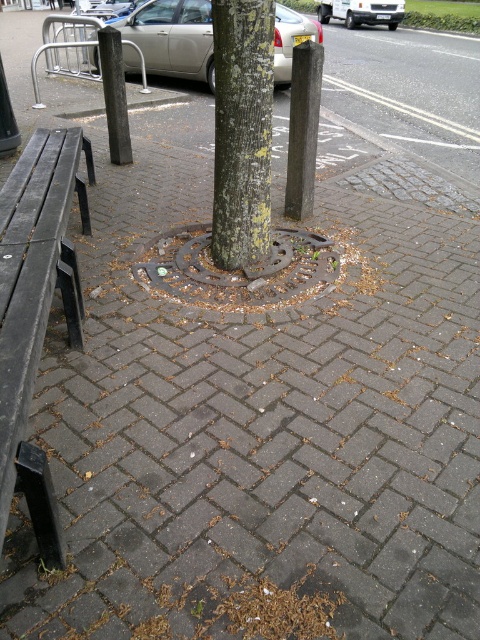
Question: Does dark gray stone post at center appear on the left side of dark gray textured pole at left?

Choices:
 (A) no
 (B) yes

Answer: (A)

Question: Which object appears farthest from the camera in this image?

Choices:
 (A) silver metallic car at upper center
 (B) dark gray stone post at center
 (C) dark gray textured pole at left
 (D) silver metallic van at upper center

Answer: (D)

Question: Does dark gray stone post at center come behind dark gray textured pole at left?

Choices:
 (A) yes
 (B) no

Answer: (B)

Question: Is dark gray stone post at center bigger than silver metallic van at upper center?

Choices:
 (A) no
 (B) yes

Answer: (A)

Question: Estimate the real-world distances between objects in this image. Which object is farther from the dark gray stone post at center?

Choices:
 (A) silver metallic car at upper center
 (B) smooth bark tree at center

Answer: (A)

Question: Among these objects, which one is farthest from the camera?

Choices:
 (A) silver metallic van at upper center
 (B) dark gray stone post at center

Answer: (A)